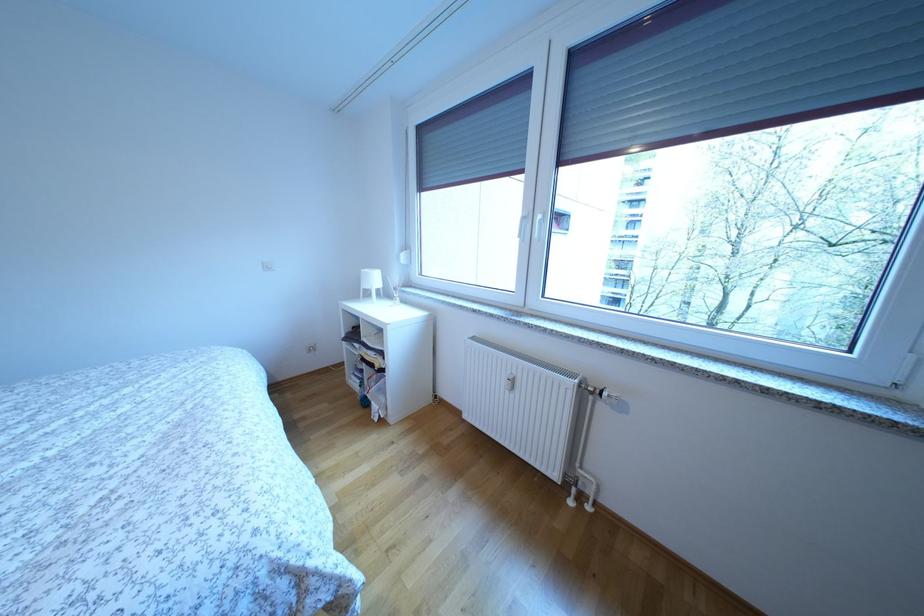
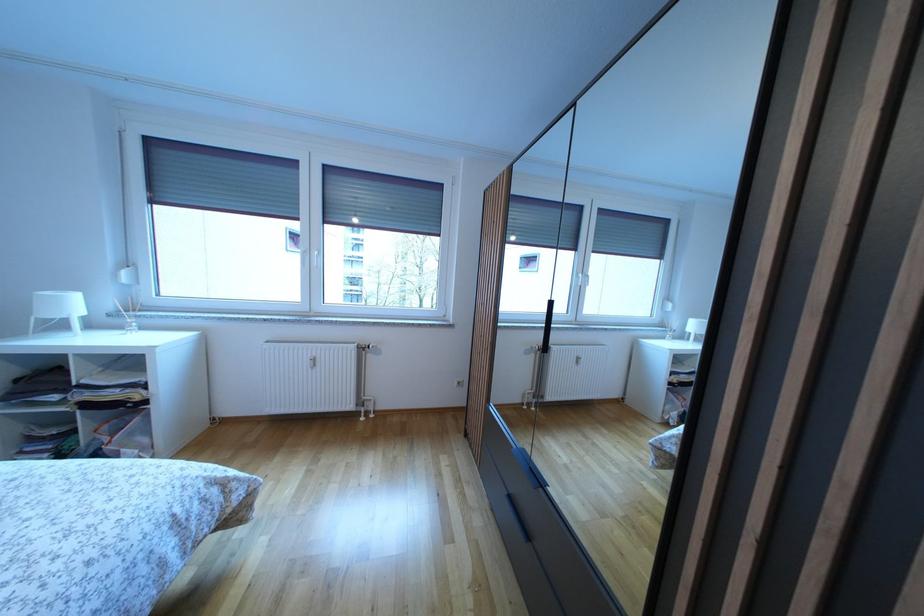
The point at [382,285] is marked in the first image. Where is the corresponding point in the second image?

(78, 310)